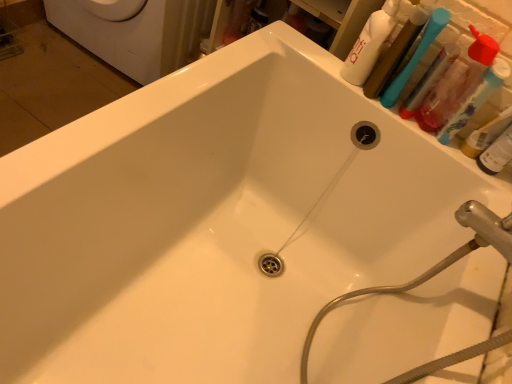
Question: Is translucent plastic bottle at upper right looking in the opposite direction of white glossy bottle at upper right?

Choices:
 (A) yes
 (B) no

Answer: (B)

Question: Can you confirm if translucent plastic bottle at upper right is bigger than white glossy bottle at upper right?

Choices:
 (A) no
 (B) yes

Answer: (A)

Question: Does translucent plastic bottle at upper right appear on the right side of white glossy bottle at upper right?

Choices:
 (A) yes
 (B) no

Answer: (A)

Question: Is translucent plastic bottle at upper right not within white glossy bottle at upper right?

Choices:
 (A) yes
 (B) no

Answer: (A)

Question: Considering the relative sizes of translucent plastic bottle at upper right and white glossy bottle at upper right in the image provided, is translucent plastic bottle at upper right smaller than white glossy bottle at upper right?

Choices:
 (A) yes
 (B) no

Answer: (A)

Question: Would you say white glossy bottle at upper right is to the left or to the right of blue plastic toothbrush at upper right, which appears as the 2th toothbrush when viewed from the right, in the picture?

Choices:
 (A) left
 (B) right

Answer: (A)

Question: In terms of size, does white glossy bottle at upper right appear bigger or smaller than blue plastic toothbrush at upper right, which appears as the 2th toothbrush when viewed from the right?

Choices:
 (A) small
 (B) big

Answer: (B)

Question: From the image's perspective, is white glossy bottle at upper right positioned above or below blue plastic toothbrush at upper right, placed as the 1th toothbrush when sorted from left to right?

Choices:
 (A) below
 (B) above

Answer: (B)

Question: In terms of height, does white glossy bottle at upper right look taller or shorter compared to blue plastic toothbrush at upper right, placed as the 1th toothbrush when sorted from left to right?

Choices:
 (A) tall
 (B) short

Answer: (A)

Question: In the image, is translucent plastic bottle at upper right positioned in front of or behind white glossy bottle at upper right?

Choices:
 (A) behind
 (B) front

Answer: (B)

Question: From the image's perspective, is translucent plastic bottle at upper right positioned above or below white glossy bottle at upper right?

Choices:
 (A) below
 (B) above

Answer: (A)

Question: In terms of height, does translucent plastic bottle at upper right look taller or shorter compared to white glossy bottle at upper right?

Choices:
 (A) tall
 (B) short

Answer: (B)

Question: From a real-world perspective, is translucent plastic bottle at upper right physically located above or below white glossy bottle at upper right?

Choices:
 (A) above
 (B) below

Answer: (B)

Question: Is point (142, 23) positioned closer to the camera than point (436, 8)?

Choices:
 (A) farther
 (B) closer

Answer: (A)

Question: Is white glossy washing machine at upper left wider or thinner than blue plastic toothbrush at upper right, placed as the 1th toothbrush when sorted from left to right?

Choices:
 (A) thin
 (B) wide

Answer: (B)